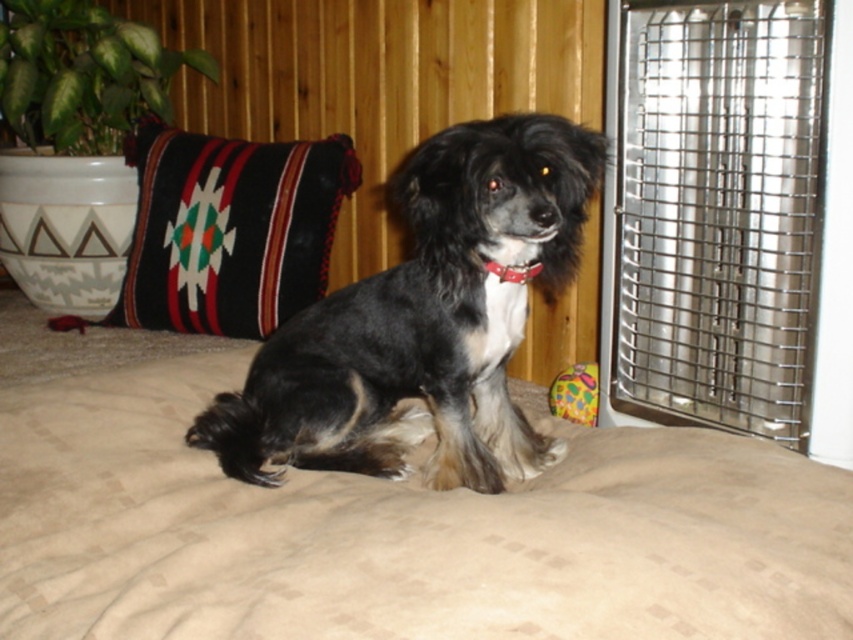
You are a pet owner who wants to place a new small pet carrier next to the beige fabric dog bed at center and the metallic grid heater at right. Based on their sizes, which object should you place the carrier next to to ensure it fits comfortably?

The beige fabric dog bed at center has a larger size compared to the metallic grid heater at right, so placing the carrier next to the metallic grid heater at right would leave more space for the carrier to fit comfortably.

You are a dog owner who wants to buy a new dog bed for your pet. You see the beige fabric dog bed at center and the black fur dog at center in the image. Which item is wider?

The beige fabric dog bed at center is wider than the black fur dog at center.